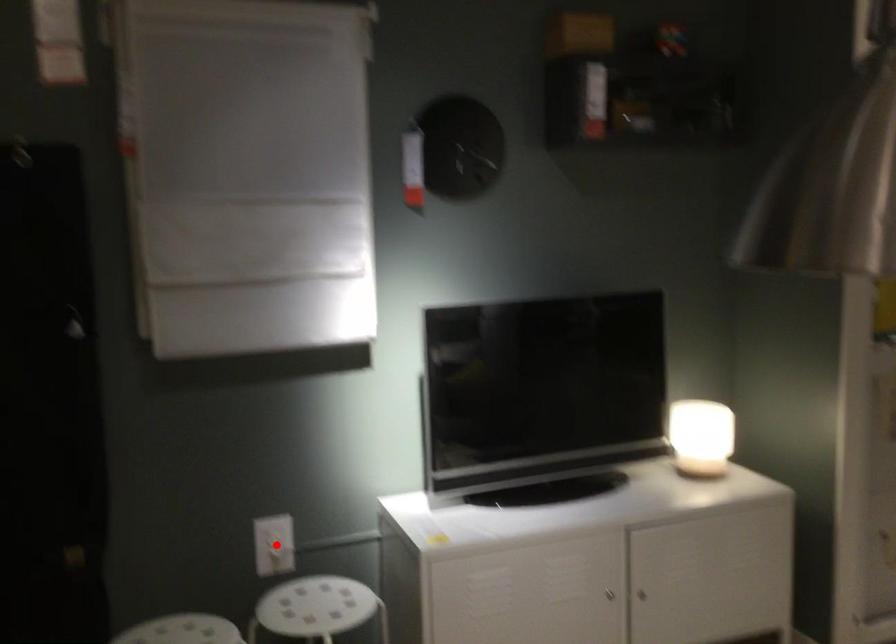
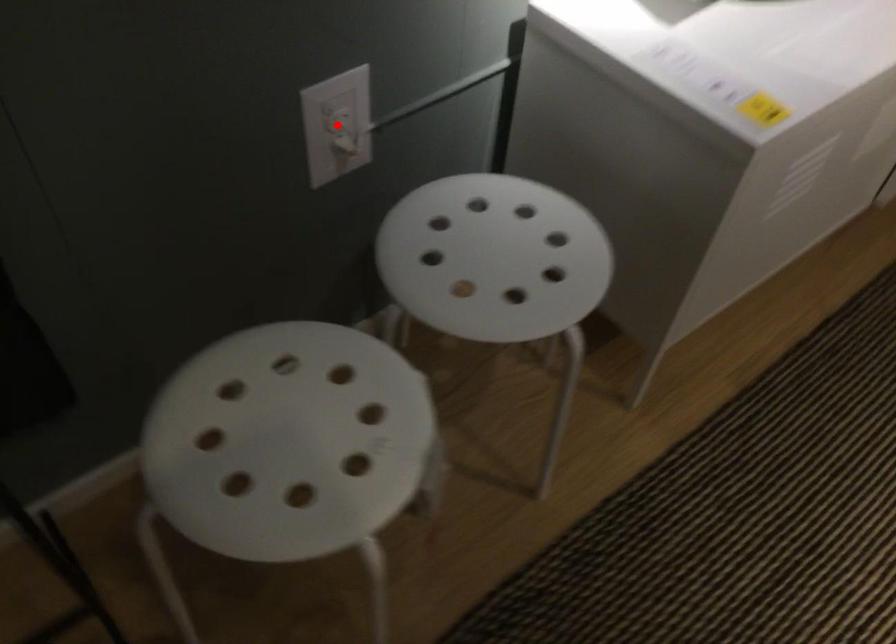
Looking at this image, I am providing you with two images of the same scene from different viewpoints. A red point is marked on the first image and another point is marked on the second image. Is the marked point in image1 the same physical position as the marked point in image2?

Yes